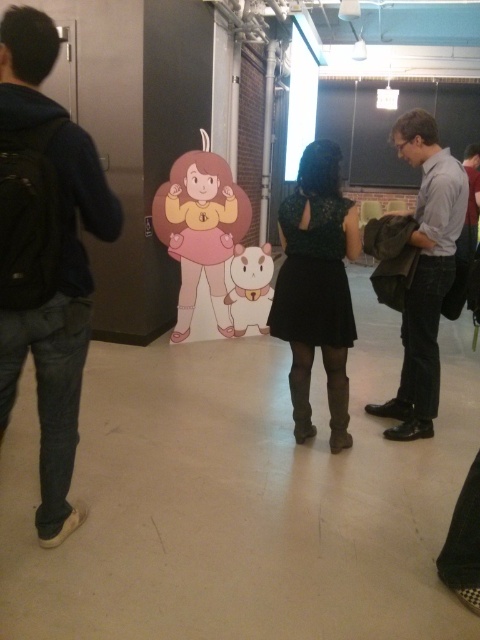
You are moving through a hallway and need to place your black backpack at left and green lace dress at center neatly on a narrow shelf. Which item can fit better on the shelf due to its size?

The black backpack at left is thinner than the green lace dress at center, so it can fit better on the narrow shelf.

You are standing in the hallway and need to retrieve both the black backpack at left and the dark gray fabric jacket at right. Which item is closer to you?

The black backpack at left is closer to you because it is in front of the dark gray fabric jacket at right.

You are standing in the hallway and need to retrieve both the black backpack at left and the dark gray fabric jacket at right. Which item should you approach first if you want to pick up the one closest to you?

The black backpack at left is to the left of the dark gray fabric jacket at right, so it is closer to you. You should approach the black backpack at left first.